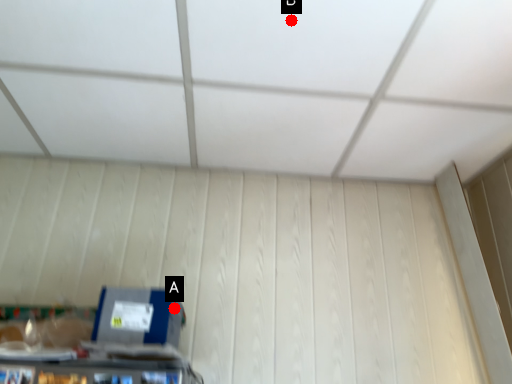
Question: Two points are circled on the image, labeled by A and B beside each circle. Which point is further to the camera?

Choices:
 (A) A is further
 (B) B is further

Answer: (A)